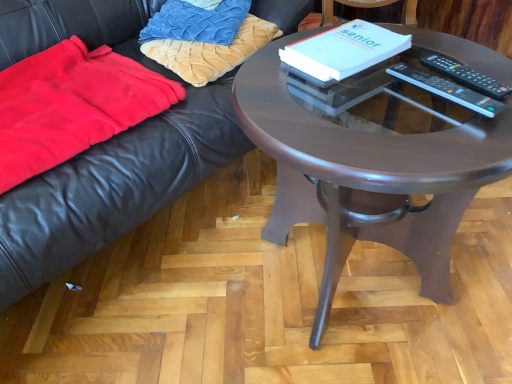
Find the location of a particular element. The image size is (512, 384). free space in front of black plastic remote control at right, which is counted as the first remote control, starting from the left is located at coordinates (445, 145).